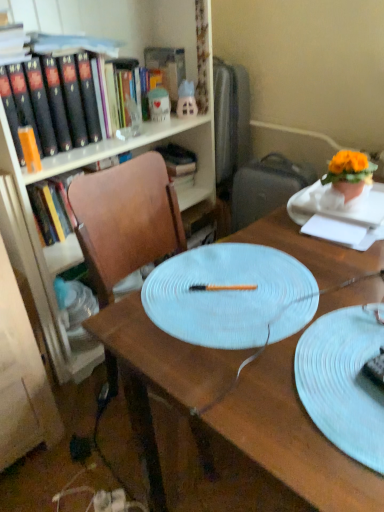
Question: Is hardcover book at center, the 1th book from the right, smaller than gray fabric suitcase at right?

Choices:
 (A) yes
 (B) no

Answer: (A)

Question: Is the depth of hardcover book at center, which appears as the 2th book when viewed from the front, less than that of gray fabric suitcase at right?

Choices:
 (A) yes
 (B) no

Answer: (B)

Question: Is hardcover book at center, the 1th book from the back, oriented away from gray fabric suitcase at right?

Choices:
 (A) no
 (B) yes

Answer: (A)

Question: Is hardcover book at center, the 1th book from the back, far away from gray fabric suitcase at right?

Choices:
 (A) no
 (B) yes

Answer: (A)

Question: Considering the relative sizes of hardcover book at center, the 1th book from the right, and gray fabric suitcase at right in the image provided, is hardcover book at center, the 1th book from the right, bigger than gray fabric suitcase at right?

Choices:
 (A) no
 (B) yes

Answer: (A)

Question: Is hardcover book at center, the 1th book from the back, next to gray fabric suitcase at right and touching it?

Choices:
 (A) yes
 (B) no

Answer: (B)

Question: Is white glossy house at upper center, positioned as the first toy in right-to-left order, facing towards wooden chair at center?

Choices:
 (A) no
 (B) yes

Answer: (A)

Question: From a real-world perspective, is white glossy house at upper center, the 2th toy when ordered from left to right, on wooden chair at center?

Choices:
 (A) yes
 (B) no

Answer: (A)

Question: Is white glossy house at upper center, the 2th toy when ordered from left to right, positioned with its back to wooden chair at center?

Choices:
 (A) no
 (B) yes

Answer: (A)

Question: Is white glossy house at upper center, the 2th toy when ordered from left to right, taller than wooden chair at center?

Choices:
 (A) no
 (B) yes

Answer: (A)

Question: From the image's perspective, is white glossy house at upper center, positioned as the first toy in right-to-left order, under wooden chair at center?

Choices:
 (A) no
 (B) yes

Answer: (A)

Question: Is white glossy house at upper center, positioned as the first toy in right-to-left order, at the left side of wooden chair at center?

Choices:
 (A) no
 (B) yes

Answer: (B)

Question: Does white paper at upper right have a greater height compared to orange matte book at left, which appears as the first book when viewed from the left?

Choices:
 (A) no
 (B) yes

Answer: (A)